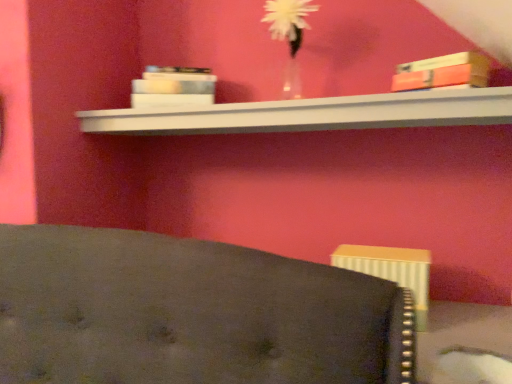
Where is `translucent glass vase at upper center`? The height and width of the screenshot is (384, 512). translucent glass vase at upper center is located at coordinates [x=289, y=37].

Where is `white glossy shelf at upper center`? Image resolution: width=512 pixels, height=384 pixels. white glossy shelf at upper center is located at coordinates (312, 114).

Find the location of a particular element. This screenshot has height=384, width=512. white matte book at upper center, arranged as the 2th book when viewed from the front is located at coordinates (173, 87).

This screenshot has height=384, width=512. Identify the location of book above the matte orange book at upper right, acting as the 2th book starting from the back (from the image's perspective). (173, 87).

Is matte orange book at upper right, acting as the 2th book starting from the back, facing towards white matte book at upper center, the first book from the back?

No, matte orange book at upper right, acting as the 2th book starting from the back, is not facing towards white matte book at upper center, the first book from the back.

Which object is positioned more to the left, matte orange book at upper right, marked as the first book in a right-to-left arrangement, or white matte book at upper center, acting as the first book starting from the left?

white matte book at upper center, acting as the first book starting from the left.

Is white matte book at upper center, arranged as the 2th book when viewed from the front, located within matte orange book at upper right, which is counted as the 1th book, starting from the front?

No.

I want to click on shelf below the translucent glass vase at upper center (from the image's perspective), so click(x=312, y=114).

Is translucent glass vase at upper center oriented towards white glossy shelf at upper center?

No, translucent glass vase at upper center is not oriented towards white glossy shelf at upper center.

In the scene shown: Which object is closer to the camera, translucent glass vase at upper center or white glossy shelf at upper center?

Positioned in front is white glossy shelf at upper center.

Does point (276, 3) lie in front of point (144, 133)?

Yes, it is.

From the image's perspective, is white matte book at upper center, the first book from the back, on translucent glass vase at upper center?

No, from the image's perspective, white matte book at upper center, the first book from the back, is not over translucent glass vase at upper center.

Who is bigger, white matte book at upper center, arranged as the 2th book when viewed from the front, or translucent glass vase at upper center?

translucent glass vase at upper center is bigger.

Considering the sizes of white matte book at upper center, the first book from the back, and translucent glass vase at upper center in the image, is white matte book at upper center, the first book from the back, taller or shorter than translucent glass vase at upper center?

Considering their sizes, white matte book at upper center, the first book from the back, has less height than translucent glass vase at upper center.

Does white matte book at upper center, acting as the first book starting from the left, appear on the left side of translucent glass vase at upper center?

Correct, you'll find white matte book at upper center, acting as the first book starting from the left, to the left of translucent glass vase at upper center.

Is matte orange book at upper right, which is counted as the 1th book, starting from the front, aimed at translucent glass vase at upper center?

No, matte orange book at upper right, which is counted as the 1th book, starting from the front, is not turned towards translucent glass vase at upper center.

Can you confirm if matte orange book at upper right, marked as the first book in a right-to-left arrangement, is positioned to the right of translucent glass vase at upper center?

Indeed, matte orange book at upper right, marked as the first book in a right-to-left arrangement, is positioned on the right side of translucent glass vase at upper center.

From the image's perspective, is matte orange book at upper right, acting as the 2th book starting from the back, under translucent glass vase at upper center?

Yes.

Is matte orange book at upper right, marked as the first book in a right-to-left arrangement, inside or outside of translucent glass vase at upper center?

matte orange book at upper right, marked as the first book in a right-to-left arrangement, exists outside the volume of translucent glass vase at upper center.

The height and width of the screenshot is (384, 512). Find the location of `shelf lying below the translucent glass vase at upper center (from the image's perspective)`. shelf lying below the translucent glass vase at upper center (from the image's perspective) is located at coordinates (312, 114).

Does white glossy shelf at upper center have a greater height compared to translucent glass vase at upper center?

In fact, white glossy shelf at upper center may be shorter than translucent glass vase at upper center.

Is white glossy shelf at upper center inside the boundaries of translucent glass vase at upper center, or outside?

white glossy shelf at upper center exists outside the volume of translucent glass vase at upper center.

Is white glossy shelf at upper center closer to the viewer compared to matte orange book at upper right, marked as the first book in a right-to-left arrangement?

Yes, it is in front of matte orange book at upper right, marked as the first book in a right-to-left arrangement.

Can you confirm if white glossy shelf at upper center is taller than matte orange book at upper right, marked as the first book in a right-to-left arrangement?

In fact, white glossy shelf at upper center may be shorter than matte orange book at upper right, marked as the first book in a right-to-left arrangement.

Are white glossy shelf at upper center and matte orange book at upper right, acting as the 2th book starting from the back, beside each other?

No, white glossy shelf at upper center is not next to matte orange book at upper right, acting as the 2th book starting from the back.

Considering the relative sizes of white glossy shelf at upper center and matte orange book at upper right, which is counted as the 1th book, starting from the front, in the image provided, is white glossy shelf at upper center smaller than matte orange book at upper right, which is counted as the 1th book, starting from the front,?

Incorrect, white glossy shelf at upper center is not smaller in size than matte orange book at upper right, which is counted as the 1th book, starting from the front.

Between point (245, 120) and point (165, 98), which one is positioned behind?

The point (165, 98) is farther from the camera.

Between white glossy shelf at upper center and white matte book at upper center, which is the 2th book from right to left, which one is positioned behind?

white matte book at upper center, which is the 2th book from right to left, is further away from the camera.

The width and height of the screenshot is (512, 384). What are the coordinates of `shelf located in front of the white matte book at upper center, acting as the first book starting from the left` in the screenshot? It's located at (312, 114).

Which of these two, white glossy shelf at upper center or white matte book at upper center, arranged as the 2th book when viewed from the front, is bigger?

Bigger between the two is white glossy shelf at upper center.

This screenshot has height=384, width=512. I want to click on book below the white matte book at upper center, which is the 2th book from right to left (from the image's perspective), so click(443, 72).

What are the coordinates of `shelf in front of the translucent glass vase at upper center` in the screenshot? It's located at (312, 114).

Based on the photo, looking at the image, which one is located closer to white matte book at upper center, acting as the first book starting from the left, matte orange book at upper right, which is counted as the 1th book, starting from the front, or translucent glass vase at upper center?

The object closer to white matte book at upper center, acting as the first book starting from the left, is translucent glass vase at upper center.

Which object lies nearer to the anchor point matte orange book at upper right, which is the second book in left-to-right order, white glossy shelf at upper center or white matte book at upper center, acting as the first book starting from the left?

white glossy shelf at upper center is positioned closer to the anchor matte orange book at upper right, which is the second book in left-to-right order.

Considering their positions, is translucent glass vase at upper center positioned closer to matte orange book at upper right, marked as the first book in a right-to-left arrangement, than white matte book at upper center, the first book from the back?

translucent glass vase at upper center.

When comparing their distances from translucent glass vase at upper center, does matte orange book at upper right, which is the second book in left-to-right order, or white matte book at upper center, acting as the first book starting from the left, seem further?

The object further to translucent glass vase at upper center is matte orange book at upper right, which is the second book in left-to-right order.

When comparing their distances from matte orange book at upper right, marked as the first book in a right-to-left arrangement, does white matte book at upper center, arranged as the 2th book when viewed from the front, or translucent glass vase at upper center seem further?

white matte book at upper center, arranged as the 2th book when viewed from the front.

From the image, which object appears to be farther from white matte book at upper center, acting as the first book starting from the left, translucent glass vase at upper center or white glossy shelf at upper center?

translucent glass vase at upper center is positioned further to the anchor white matte book at upper center, acting as the first book starting from the left.

Estimate the real-world distances between objects in this image. Which object is further from white glossy shelf at upper center, translucent glass vase at upper center or white matte book at upper center, arranged as the 2th book when viewed from the front?

translucent glass vase at upper center lies further to white glossy shelf at upper center than the other object.

When comparing their distances from translucent glass vase at upper center, does white glossy shelf at upper center or white matte book at upper center, arranged as the 2th book when viewed from the front, seem closer?

The object closer to translucent glass vase at upper center is white glossy shelf at upper center.

Find the location of a particular element. This screenshot has width=512, height=384. shelf located between white matte book at upper center, arranged as the 2th book when viewed from the front, and translucent glass vase at upper center in the left-right direction is located at coordinates (312, 114).

Image resolution: width=512 pixels, height=384 pixels. Identify the location of shelf between white matte book at upper center, the first book from the back, and matte orange book at upper right, marked as the first book in a right-to-left arrangement. (312, 114).

At what (x,y) coordinates should I click in order to perform the action: click on floral arrangement between white glossy shelf at upper center and matte orange book at upper right, which is the second book in left-to-right order, from left to right. Please return your answer as a coordinate pair (x, y). This screenshot has width=512, height=384. Looking at the image, I should click on (289, 37).

Where is `floral arrangement situated between white matte book at upper center, which is the 2th book from right to left, and matte orange book at upper right, which is counted as the 1th book, starting from the front, from left to right`? floral arrangement situated between white matte book at upper center, which is the 2th book from right to left, and matte orange book at upper right, which is counted as the 1th book, starting from the front, from left to right is located at coordinates (289, 37).